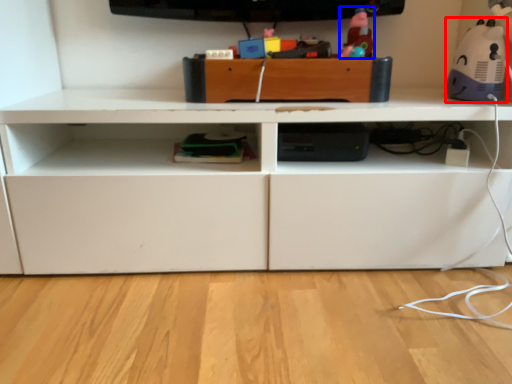
Question: Among these objects, which one is farthest to the camera, toy (highlighted by a red box) or toy (highlighted by a blue box)?

Choices:
 (A) toy
 (B) toy

Answer: (B)